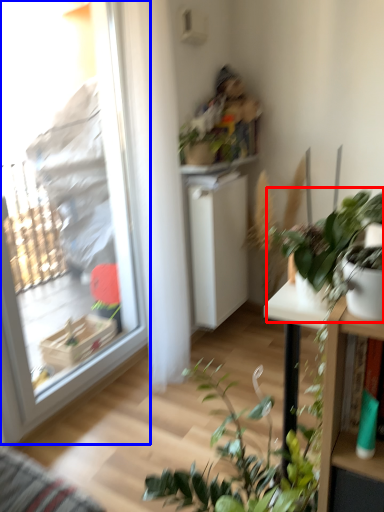
Question: Which of the following is the closest to the observer, houseplant (highlighted by a red box) or window (highlighted by a blue box)?

Choices:
 (A) houseplant
 (B) window

Answer: (A)